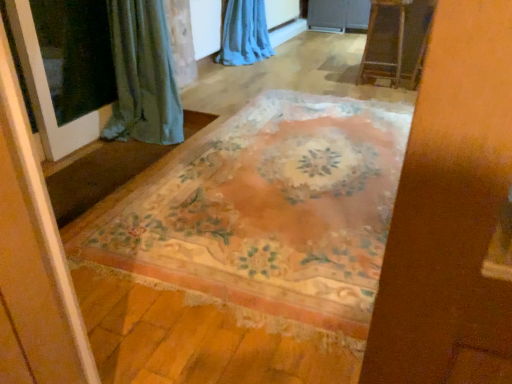
Question: Is wooden ladder at upper right completely or partially outside of transparent glass screen door at left?

Choices:
 (A) no
 (B) yes

Answer: (B)

Question: Is wooden ladder at upper right facing away from transparent glass screen door at left?

Choices:
 (A) no
 (B) yes

Answer: (A)

Question: Does wooden ladder at upper right have a smaller size compared to transparent glass screen door at left?

Choices:
 (A) no
 (B) yes

Answer: (A)

Question: Does wooden ladder at upper right lie in front of transparent glass screen door at left?

Choices:
 (A) yes
 (B) no

Answer: (B)

Question: Is wooden ladder at upper right at the left side of transparent glass screen door at left?

Choices:
 (A) no
 (B) yes

Answer: (A)

Question: Is transparent glass screen door at left located within wooden ladder at upper right?

Choices:
 (A) no
 (B) yes

Answer: (A)

Question: Is the position of floral-patterned rug at center more distant than that of blue sheer curtain at upper center?

Choices:
 (A) no
 (B) yes

Answer: (A)

Question: Is floral-patterned rug at center at the right side of blue sheer curtain at upper center?

Choices:
 (A) no
 (B) yes

Answer: (B)

Question: Could you tell me if floral-patterned rug at center is facing blue sheer curtain at upper center?

Choices:
 (A) yes
 (B) no

Answer: (B)

Question: Does floral-patterned rug at center have a greater width compared to blue sheer curtain at upper center?

Choices:
 (A) yes
 (B) no

Answer: (A)

Question: Considering the relative sizes of floral-patterned rug at center and blue sheer curtain at upper center in the image provided, is floral-patterned rug at center smaller than blue sheer curtain at upper center?

Choices:
 (A) yes
 (B) no

Answer: (A)

Question: Is floral-patterned rug at center in contact with blue sheer curtain at upper center?

Choices:
 (A) yes
 (B) no

Answer: (B)

Question: Is transparent glass screen door at left shorter than blue sheer curtain at upper center?

Choices:
 (A) yes
 (B) no

Answer: (B)